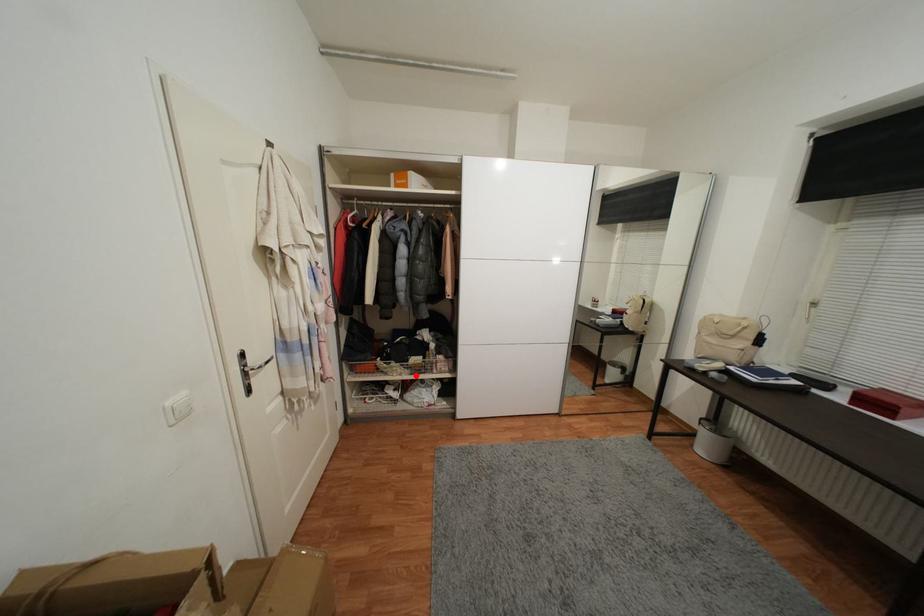
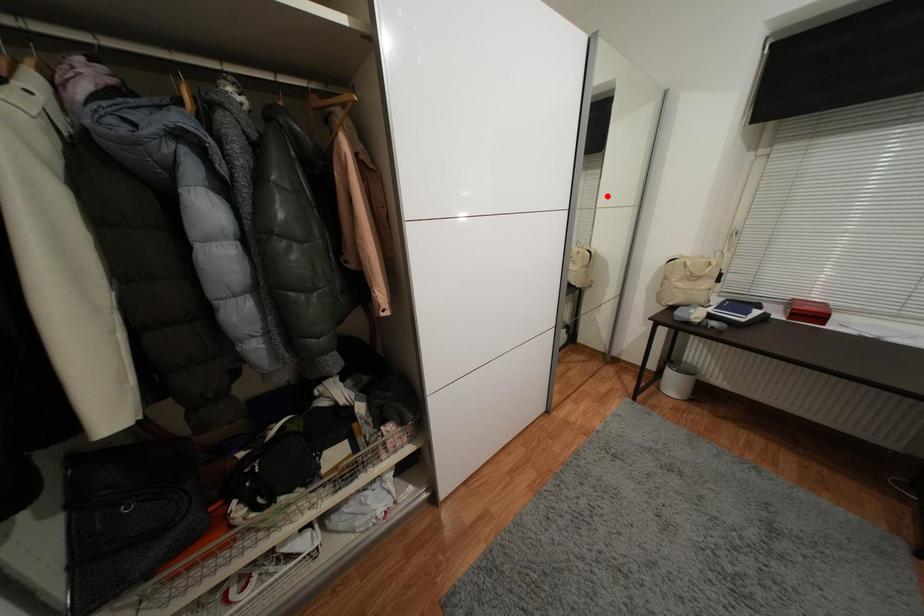
From the picture: I am providing you with two images of the same scene from different viewpoints. A red point is marked on the first image and another point is marked on the second image. Is the marked point in image1 the same physical position as the marked point in image2?

No